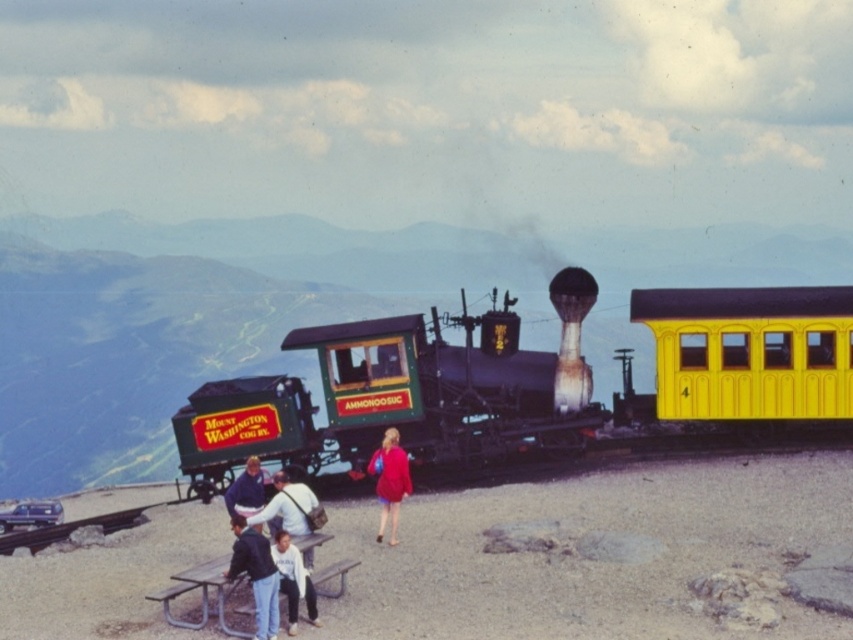
You are standing at the summit of Mount Washington and want to take a photo of both the yellow passenger car marked with the number 4 and the picnic tables. You notice two points of interest in the scene labeled as point [494,412] and point [833,358]. Which point should you focus on to ensure both the yellow passenger car marked with the number 4 and the picnic tables are in clear view?

You should focus on point [494,412] because it is closer to the camera than point [833,358], allowing both the yellow passenger car marked with the number 4 and the picnic tables to be in clear view.

Consider the image. You are a photographer standing at the summit of Mount Washington. You need to take a photo of the matte red dress at center. Where should you position yourself to capture the dress in the frame?

To capture the matte red dress at center in the frame, position yourself at the point specified by the coordinates provided in the Objects Description, which is at point (x=390, y=481).